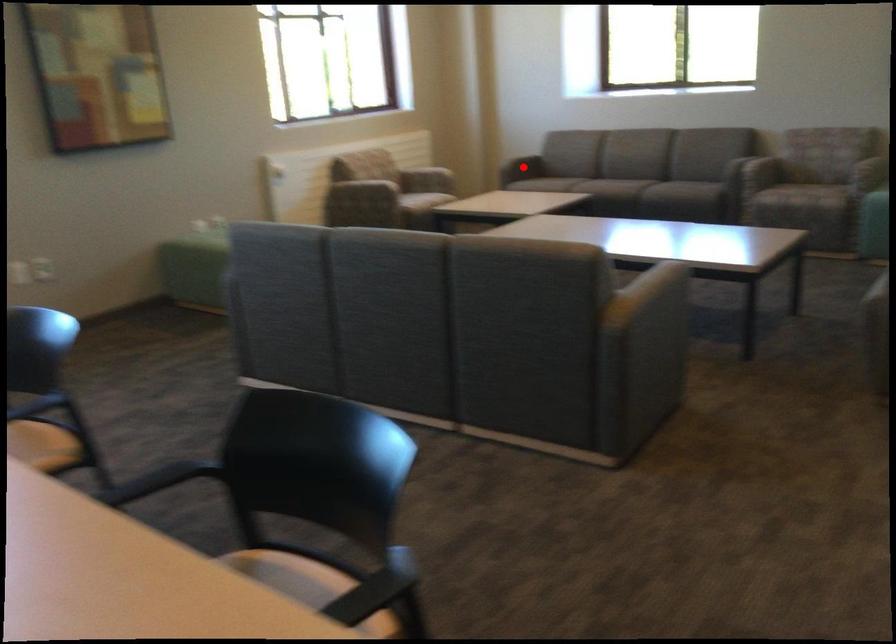
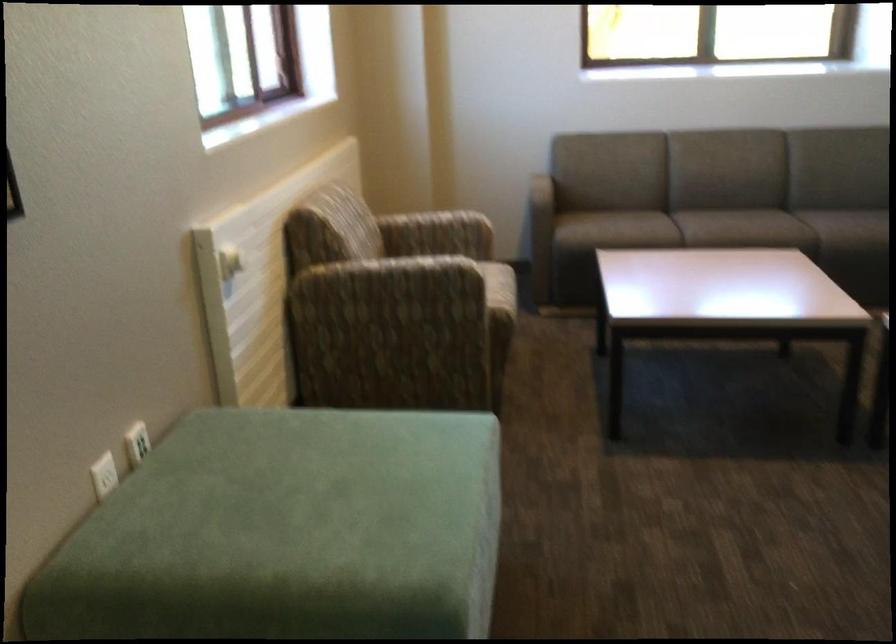
Question: I am providing you with two images of the same scene from different viewpoints. A red point is marked on the first image. At the location where the point appears in image 1, is it still visible in image 2?

Choices:
 (A) Yes
 (B) No

Answer: (B)